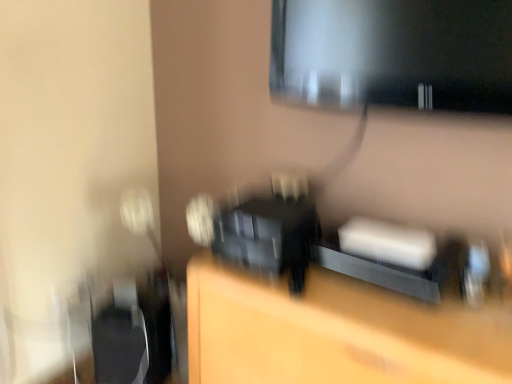
Locate an element on the screen. matte black speaker at center is located at coordinates (335, 332).

This screenshot has width=512, height=384. What are the coordinates of `black plastic swivel chair at left` in the screenshot? It's located at (119, 346).

Considering the sizes of matte black speaker at center and matte black monitor at upper right in the image, is matte black speaker at center taller or shorter than matte black monitor at upper right?

matte black speaker at center is taller than matte black monitor at upper right.

The width and height of the screenshot is (512, 384). Find the location of `computer monitor located behind the matte black speaker at center`. computer monitor located behind the matte black speaker at center is located at coordinates (393, 53).

Can you tell me how much matte black speaker at center and matte black monitor at upper right differ in facing direction?

1.45 degrees separate the facing orientations of matte black speaker at center and matte black monitor at upper right.

Based on the photo, measure the distance from matte black speaker at center to matte black monitor at upper right.

A distance of 28.21 inches exists between matte black speaker at center and matte black monitor at upper right.

Is matte black speaker at center not within black plastic swivel chair at left?

Yes.

Is matte black speaker at center turned away from black plastic swivel chair at left?

No, matte black speaker at center's orientation is not away from black plastic swivel chair at left.

Which object is thinner, matte black speaker at center or black plastic swivel chair at left?

black plastic swivel chair at left is thinner.

Considering the positions of points (253, 324) and (123, 309), is point (253, 324) closer to camera compared to point (123, 309)?

Yes.

Would you say matte black monitor at upper right is to the left or to the right of matte black speaker at center in the picture?

Based on their positions, matte black monitor at upper right is located to the right of matte black speaker at center.

From a real-world perspective, is matte black monitor at upper right under matte black speaker at center?

Incorrect, from a real-world perspective, matte black monitor at upper right is higher than matte black speaker at center.

Is point (307, 84) positioned before point (375, 329)?

That is False.

How far apart are matte black monitor at upper right and matte black speaker at center?

matte black monitor at upper right is 28.21 inches from matte black speaker at center.

From the image's perspective, which object appears higher, black plastic swivel chair at left or matte black monitor at upper right?

From the image's view, matte black monitor at upper right is above.

At what (x,y) coordinates should I click in order to perform the action: click on computer monitor on the right of black plastic swivel chair at left. Please return your answer as a coordinate pair (x, y). Looking at the image, I should click on (393, 53).

Can you confirm if black plastic swivel chair at left is smaller than matte black monitor at upper right?

No.

Could you tell me if black plastic swivel chair at left is facing matte black speaker at center?

No, black plastic swivel chair at left is not oriented towards matte black speaker at center.

Identify the location of swivel chair lying behind the matte black speaker at center. The width and height of the screenshot is (512, 384). click(x=119, y=346).

From the picture: Between black plastic swivel chair at left and matte black speaker at center, which one is positioned in front?

matte black speaker at center is closer to the camera.

From a real-world perspective, who is located lower, matte black monitor at upper right or black plastic swivel chair at left?

black plastic swivel chair at left.

Is matte black monitor at upper right to the left of black plastic swivel chair at left from the viewer's perspective?

No, matte black monitor at upper right is not to the left of black plastic swivel chair at left.

Is matte black monitor at upper right oriented away from black plastic swivel chair at left?

No, black plastic swivel chair at left is not at the back of matte black monitor at upper right.

Which of these two, matte black monitor at upper right or black plastic swivel chair at left, is wider?

black plastic swivel chair at left.

Identify the location of furniture below the matte black monitor at upper right (from a real-world perspective). (335, 332).

Identify the location of swivel chair on the left of matte black speaker at center. (119, 346).

From the image, which object appears to be farther from black plastic swivel chair at left, matte black monitor at upper right or matte black speaker at center?

matte black monitor at upper right is further to black plastic swivel chair at left.

Which object lies nearer to the anchor point matte black speaker at center, matte black monitor at upper right or black plastic swivel chair at left?

Among the two, black plastic swivel chair at left is located nearer to matte black speaker at center.

Estimate the real-world distances between objects in this image. Which object is closer to matte black speaker at center, black plastic swivel chair at left or matte black monitor at upper right?

Among the two, black plastic swivel chair at left is located nearer to matte black speaker at center.

Which object lies nearer to the anchor point matte black monitor at upper right, black plastic swivel chair at left or matte black speaker at center?

matte black speaker at center lies closer to matte black monitor at upper right than the other object.

From the image, which object appears to be farther from black plastic swivel chair at left, matte black speaker at center or matte black monitor at upper right?

Based on the image, matte black monitor at upper right appears to be further to black plastic swivel chair at left.

Based on their spatial positions, is matte black speaker at center or black plastic swivel chair at left closer to matte black monitor at upper right?

matte black speaker at center is closer to matte black monitor at upper right.

Identify the location of furniture between matte black monitor at upper right and black plastic swivel chair at left vertically. tap(335, 332).